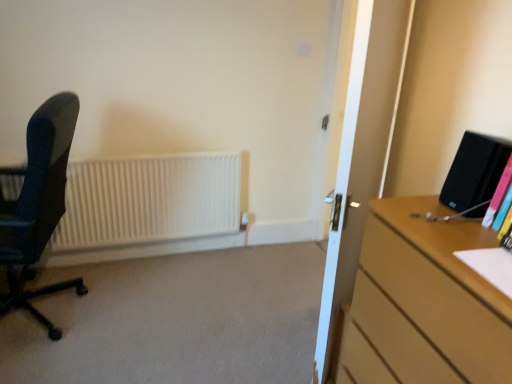
Locate an element on the screen. vacant area that is situated to the right of white matte radiator at left is located at coordinates (226, 278).